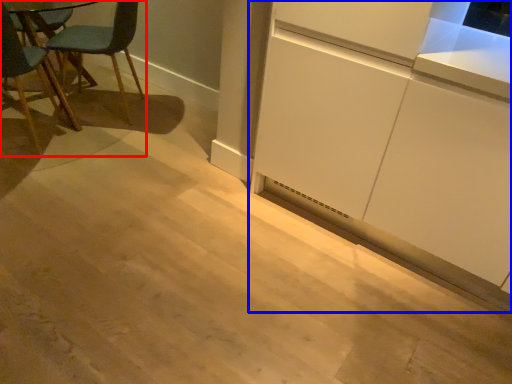
Question: Which of the following is the farthest to the observer, chair (highlighted by a red box) or cabinetry (highlighted by a blue box)?

Choices:
 (A) chair
 (B) cabinetry

Answer: (A)